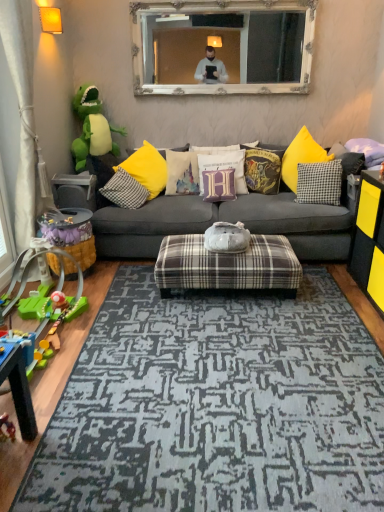
The height and width of the screenshot is (512, 384). Describe the element at coordinates (219, 185) in the screenshot. I see `purple velvet pillow at center, the 5th pillow in the right-to-left sequence` at that location.

Describe the element at coordinates (22, 109) in the screenshot. I see `white fabric curtain at left` at that location.

How much space does matte gray table at left, arranged as the first table when viewed from the left, occupy vertically?

matte gray table at left, arranged as the first table when viewed from the left, is 8.51 inches tall.

Consider the image. What is the approximate width of blue-gray textured rug at center?

The width of blue-gray textured rug at center is 2.09 meters.

Find the location of `white cotton cushion at center, the 6th pillow from the right`. white cotton cushion at center, the 6th pillow from the right is located at coordinates (182, 173).

From the image's perspective, is plaid fabric ottoman at center, positioned as the first table in right-to-left order, over blue-gray textured rug at center?

Correct, plaid fabric ottoman at center, positioned as the first table in right-to-left order, appears higher than blue-gray textured rug at center in the image.

The height and width of the screenshot is (512, 384). I want to click on mat beneath the plaid fabric ottoman at center, marked as the 2th table in a top-to-bottom arrangement (from a real-world perspective), so click(x=216, y=406).

From a real-world perspective, is plaid fabric ottoman at center, which is the 1th table in bottom-to-top order, above or below blue-gray textured rug at center?

plaid fabric ottoman at center, which is the 1th table in bottom-to-top order, is situated higher than blue-gray textured rug at center in the real world.

Between plaid fabric ottoman at center, acting as the 2th table starting from the left, and blue-gray textured rug at center, which one has smaller size?

blue-gray textured rug at center.

Can you confirm if plastic green toy at left, which is counted as the third toy, starting from the back, is smaller than green plush dinosaur at left, which is the fourth toy from front to back?

No, plastic green toy at left, which is counted as the third toy, starting from the back, is not smaller than green plush dinosaur at left, which is the fourth toy from front to back.

In the scene shown: Which object is more forward, plastic green toy at left, which is counted as the third toy, starting from the back, or green plush dinosaur at left, arranged as the 1th toy when viewed from the back?

plastic green toy at left, which is counted as the third toy, starting from the back.

Which is correct: plastic green toy at left, which is counted as the third toy, starting from the back, is inside green plush dinosaur at left, arranged as the 1th toy when viewed from the back, or outside of it?

plastic green toy at left, which is counted as the third toy, starting from the back, cannot be found inside green plush dinosaur at left, arranged as the 1th toy when viewed from the back.

Measure the distance from plastic green toy at left, which ranks as the second toy in front-to-back order, to green plush dinosaur at left, arranged as the 1th toy when viewed from the back.

plastic green toy at left, which ranks as the second toy in front-to-back order, and green plush dinosaur at left, arranged as the 1th toy when viewed from the back, are 4.54 feet apart.

In the scene shown: From the image's perspective, is blue-gray textured rug at center below white ornate mirror at upper center?

Yes.

Which is behind, blue-gray textured rug at center or white ornate mirror at upper center?

white ornate mirror at upper center is further away from the camera.

Is blue-gray textured rug at center oriented towards white ornate mirror at upper center?

No.

Considering the relative sizes of blue-gray textured rug at center and white ornate mirror at upper center in the image provided, is blue-gray textured rug at center thinner than white ornate mirror at upper center?

No.

Would you say plaid fabric couch at center contains plaid fabric ottoman at center, positioned as the first table in right-to-left order?

No.

Between plaid fabric couch at center and plaid fabric ottoman at center, which is the 1th table in bottom-to-top order, which one has larger width?

plaid fabric couch at center is wider.

Based on the photo, from the image's perspective, is plaid fabric couch at center positioned above or below plaid fabric ottoman at center, positioned as the first table in right-to-left order?

Clearly, from the image's perspective, plaid fabric couch at center is above plaid fabric ottoman at center, positioned as the first table in right-to-left order.

Is plaid fabric couch at center shorter than plaid fabric ottoman at center, positioned as the first table in right-to-left order?

A: Incorrect, the height of plaid fabric couch at center does not fall short of that of plaid fabric ottoman at center, positioned as the first table in right-to-left order.

Can you confirm if plaid fabric couch at center is shorter than black checkered pillow at center, the 6th pillow in the left-to-right sequence?

No.

Between plaid fabric couch at center and black checkered pillow at center, which is counted as the 2th pillow, starting from the right, which one is positioned behind?

Positioned behind is black checkered pillow at center, which is counted as the 2th pillow, starting from the right.

How many degrees apart are the facing directions of plaid fabric couch at center and black checkered pillow at center, the 6th pillow in the left-to-right sequence?

28.6 degrees separate the facing orientations of plaid fabric couch at center and black checkered pillow at center, the 6th pillow in the left-to-right sequence.

From the image's perspective, which is below, plaid fabric couch at center or black checkered pillow at center, which is counted as the 2th pillow, starting from the right?

plaid fabric couch at center, from the image's perspective.

From a real-world perspective, which is physically above, velvet harry potter-themed pillow at center, which appears as the third pillow when viewed from the right, or yellow fabric pillow at center, the first pillow in the left-to-right sequence?

From a 3D spatial view, velvet harry potter-themed pillow at center, which appears as the third pillow when viewed from the right, is above.

Between velvet harry potter-themed pillow at center, which appears as the third pillow when viewed from the right, and yellow fabric pillow at center, marked as the seventh pillow in a right-to-left arrangement, which one has larger size?

yellow fabric pillow at center, marked as the seventh pillow in a right-to-left arrangement.

From the image's perspective, which pillow is the 4th one above the yellow fabric pillow at center, marked as the seventh pillow in a right-to-left arrangement? Please provide its 2D coordinates.

[(262, 169)]

Between velvet harry potter-themed pillow at center, which is counted as the fifth pillow, starting from the left, and yellow fabric pillow at center, marked as the seventh pillow in a right-to-left arrangement, which one has more height?

velvet harry potter-themed pillow at center, which is counted as the fifth pillow, starting from the left, is taller.

Identify the location of dresser that appears below the plaid fabric couch at center (from the image's perspective). This screenshot has height=512, width=384. (369, 239).

Which of these two, black matte dresser at right or plaid fabric couch at center, stands shorter?

With less height is black matte dresser at right.

Could you tell me if black matte dresser at right is facing plaid fabric couch at center?

No, black matte dresser at right is not oriented towards plaid fabric couch at center.

You are a GUI agent. You are given a task and a screenshot of the screen. Output one action in this format:
    pyautogui.click(x=<x>, y=<y>)
    Task: Click on the table on the right of blue-gray textured rug at center
    The image size is (384, 512).
    Given the screenshot: What is the action you would take?
    pyautogui.click(x=227, y=266)

From a real-world perspective, which toy is the 3rd one underneath the green plush dinosaur at left, arranged as the 1th toy when viewed from the top? Please provide its 2D coordinates.

[(57, 284)]

Consider the image. Looking at the image, which one is located further to green plush dinosaur at left, marked as the 4th toy in a bottom-to-top arrangement, plaid fabric couch at center or white fabric curtain at left?

Among the two, plaid fabric couch at center is located further to green plush dinosaur at left, marked as the 4th toy in a bottom-to-top arrangement.

Estimate the real-world distances between objects in this image. Which object is further from black checkered pillow at center, which is counted as the 2th pillow, starting from the right, white ornate mirror at upper center or yellow fabric pillow at center, marked as the seventh pillow in a right-to-left arrangement?

The object further to black checkered pillow at center, which is counted as the 2th pillow, starting from the right, is yellow fabric pillow at center, marked as the seventh pillow in a right-to-left arrangement.

Which object lies further to the anchor point white ornate mirror at upper center, purple fabric pillow at upper right, positioned as the first pillow in right-to-left order, or purple fabric pillow at center, which ranks as the 4th pillow in right-to-left order?

The object further to white ornate mirror at upper center is purple fabric pillow at upper right, positioned as the first pillow in right-to-left order.

When comparing their distances from purple velvet pillow at center, which is counted as the third pillow, starting from the left, does purple fabric pillow at center, which ranks as the 4th pillow in right-to-left order, or plaid fabric ottoman at center, marked as the 2th table in a top-to-bottom arrangement, seem further?

Based on the image, plaid fabric ottoman at center, marked as the 2th table in a top-to-bottom arrangement, appears to be further to purple velvet pillow at center, which is counted as the third pillow, starting from the left.

Considering their positions, is blue-gray textured rug at center positioned closer to black checkered pillow at center, the 6th pillow in the left-to-right sequence, than green plush dinosaur at left, which is the fourth toy from front to back?

blue-gray textured rug at center is positioned closer to the anchor black checkered pillow at center, the 6th pillow in the left-to-right sequence.

Which object lies nearer to the anchor point blue-gray textured rug at center, purple velvet pillow at center, the 5th pillow in the right-to-left sequence, or plastic green toy at left, which is counted as the third toy, starting from the back?

plastic green toy at left, which is counted as the third toy, starting from the back, lies closer to blue-gray textured rug at center than the other object.

When comparing their distances from black matte dresser at right, does white cotton cushion at center, the 6th pillow from the right, or plastic yellow toy at left, which ranks as the second toy in back-to-front order, seem further?

Based on the image, plastic yellow toy at left, which ranks as the second toy in back-to-front order, appears to be further to black matte dresser at right.

Looking at the image, which one is located closer to purple fabric pillow at upper right, positioned as the first pillow in right-to-left order, yellow fabric pillow at center, marked as the seventh pillow in a right-to-left arrangement, or plastic green toy at left, positioned as the third toy in top-to-bottom order?

Among the two, yellow fabric pillow at center, marked as the seventh pillow in a right-to-left arrangement, is located nearer to purple fabric pillow at upper right, positioned as the first pillow in right-to-left order.

Find the location of a particular element. studio couch located between blue-gray textured rug at center and white cotton cushion at center, marked as the 2th pillow in a left-to-right arrangement, in the depth direction is located at coordinates (228, 221).

Image resolution: width=384 pixels, height=512 pixels. Identify the location of studio couch positioned between plastic yellow and blue train at lower left, marked as the first toy in a front-to-back arrangement, and matte gray table at left, acting as the 2th table starting from the right, from near to far. (228, 221).

Where is `table between matte gray table at left, which is the 1th table in top-to-bottom order, and purple fabric pillow at upper right, positioned as the first pillow in right-to-left order, from left to right`? This screenshot has width=384, height=512. table between matte gray table at left, which is the 1th table in top-to-bottom order, and purple fabric pillow at upper right, positioned as the first pillow in right-to-left order, from left to right is located at coordinates (227, 266).

At what (x,y) coordinates should I click in order to perform the action: click on pillow that lies between matte gray table at left, acting as the 2th table starting from the right, and plastic yellow toy at left, the third toy positioned from the front, from top to bottom. Please return your answer as a coordinate pair (x, y). This screenshot has height=512, width=384. Looking at the image, I should click on (125, 190).